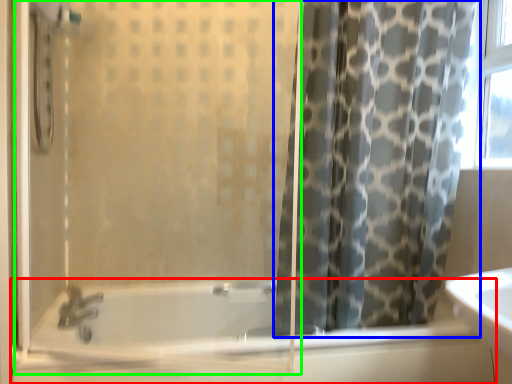
Question: Which object is positioned farthest from bathtub (highlighted by a red box)? Select from curtain (highlighted by a blue box) and screen door (highlighted by a green box).

Choices:
 (A) curtain
 (B) screen door

Answer: (A)